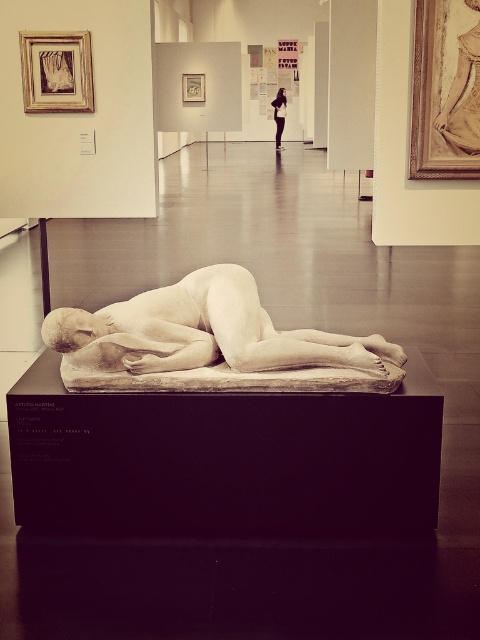
Is point (288, 332) positioned in front of point (277, 120)?

That is True.

Measure the distance between white marble sculpture at center and black leather jacket at upper center.

A distance of 61.97 feet exists between white marble sculpture at center and black leather jacket at upper center.

Which is behind, point (251, 296) or point (277, 147)?

The point (277, 147) is more distant.

I want to click on white marble sculpture at center, so click(x=204, y=332).